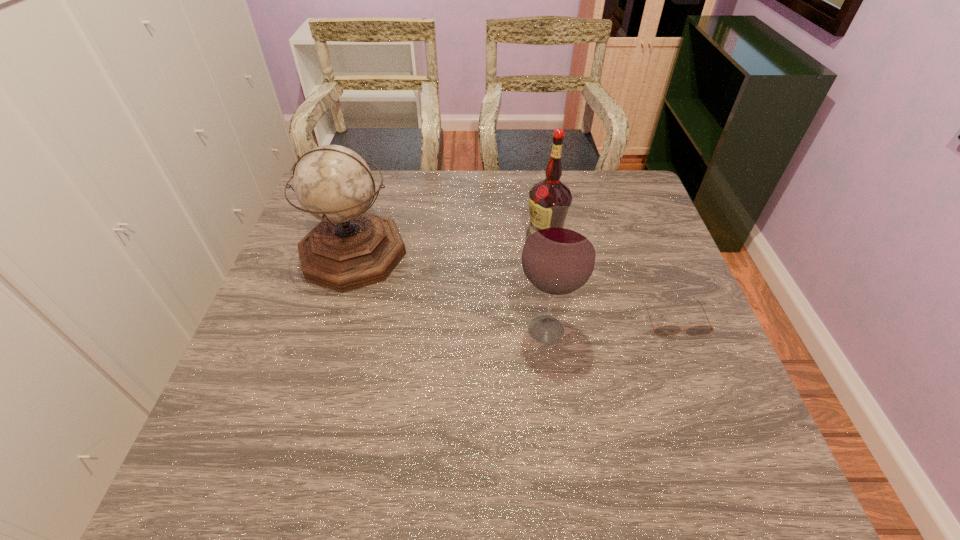
Where is `the farther alcohol`? the farther alcohol is located at coordinates (550, 192).

Find the location of a particular element. globe is located at coordinates (350, 248).

I want to click on the nearer alcohol, so click(558, 258).

Identify the location of the shortest object. The image size is (960, 540). (666, 330).

Locate an element on the screen. The width and height of the screenshot is (960, 540). sunglasses is located at coordinates (666, 330).

The image size is (960, 540). I want to click on vacant area located on the label of the farther alcohol, so click(x=468, y=239).

Where is `free space located on the label of the farther alcohol`? free space located on the label of the farther alcohol is located at coordinates (395, 239).

What are the coordinates of `free location located 0.360m on the label of the farther alcohol` in the screenshot? It's located at (397, 239).

This screenshot has width=960, height=540. In order to click on vacant area situated 0.130m on the surface of the globe in this screenshot , I will do `click(329, 335)`.

Locate an element on the screen. The width and height of the screenshot is (960, 540). vacant space situated on the right of the nearer alcohol is located at coordinates (682, 329).